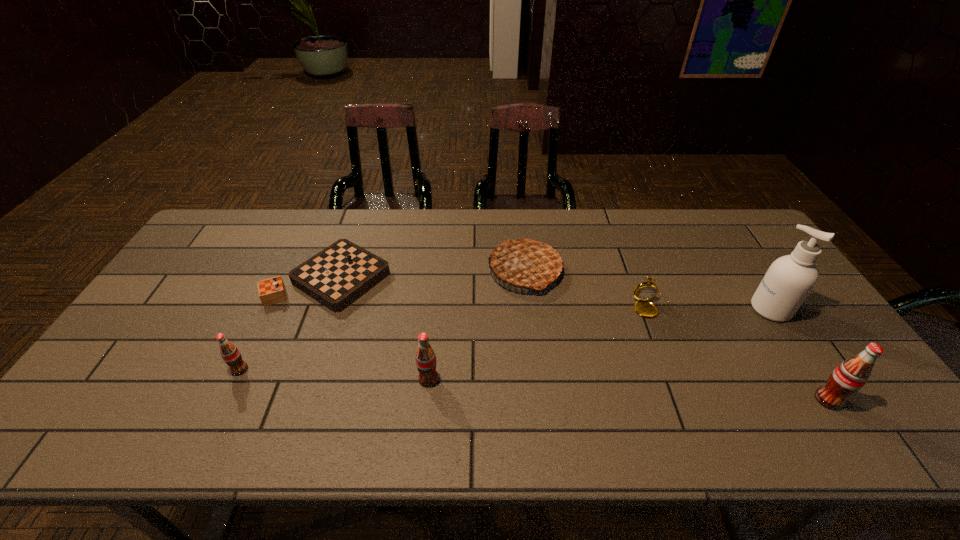
Find the location of `the shortest object`. the shortest object is located at coordinates (337, 276).

This screenshot has height=540, width=960. Find the location of `free location located 0.180m on the right of the shortest soda`. free location located 0.180m on the right of the shortest soda is located at coordinates pyautogui.click(x=320, y=370).

Locate an element on the screen. The image size is (960, 540). free location located on the back of the second tallest soda is located at coordinates (438, 287).

Locate an element on the screen. Image resolution: width=960 pixels, height=540 pixels. vacant area situated on the back of the tallest soda is located at coordinates (753, 283).

At what (x,y) coordinates should I click in order to perform the action: click on free space located 0.150m on the face of the fifth object from left to right. Please return your answer as a coordinate pair (x, y). Looking at the image, I should click on click(674, 363).

Where is `free region located 0.090m on the front of the fourth object from left to right`? This screenshot has height=540, width=960. free region located 0.090m on the front of the fourth object from left to right is located at coordinates (530, 321).

This screenshot has width=960, height=540. What are the coordinates of `vacant space located on the front label of the tallest object` in the screenshot? It's located at (695, 309).

You are a GUI agent. You are given a task and a screenshot of the screen. Output one action in this format:
    pyautogui.click(x=<x>, y=<y>)
    Task: Click on the vacant region located on the front label of the tallest object
    This screenshot has height=540, width=960.
    Given the screenshot: What is the action you would take?
    pyautogui.click(x=622, y=309)

This screenshot has height=540, width=960. In order to click on vacant space situated on the front label of the tallest object in this screenshot , I will do `click(706, 309)`.

Where is `free region located on the right of the shortest object`? This screenshot has width=960, height=540. free region located on the right of the shortest object is located at coordinates (506, 278).